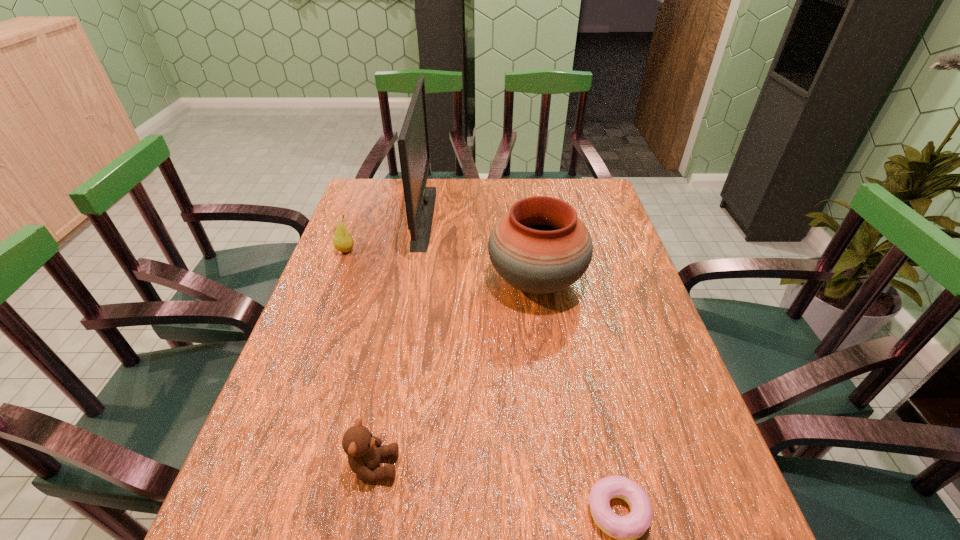
This screenshot has width=960, height=540. I want to click on unoccupied position between the teddy bear and the pottery, so click(455, 374).

This screenshot has width=960, height=540. What are the coordinates of `vacant area that lies between the teddy bear and the monitor` in the screenshot? It's located at (399, 341).

This screenshot has width=960, height=540. Find the location of `the closest object to the pottery`. the closest object to the pottery is located at coordinates (413, 142).

Identify the location of object that is the closest to the shortest object. This screenshot has width=960, height=540. (364, 451).

Where is `vacant space that satisfies the following two spatial constraints: 1. on the front-facing side of the fourth shortest object; 2. on the right side of the monitor`? vacant space that satisfies the following two spatial constraints: 1. on the front-facing side of the fourth shortest object; 2. on the right side of the monitor is located at coordinates (413, 282).

The height and width of the screenshot is (540, 960). Identify the location of free point that satisfies the following two spatial constraints: 1. on the front side of the pottery; 2. on the face of the teddy bear. (563, 467).

Find the location of a particular element. This screenshot has width=960, height=540. vacant region that satisfies the following two spatial constraints: 1. on the front-facing side of the second tallest object; 2. on the left side of the monitor is located at coordinates (413, 282).

Identify the location of vacant area in the image that satisfies the following two spatial constraints: 1. on the front-facing side of the monitor; 2. on the front side of the pear. (419, 251).